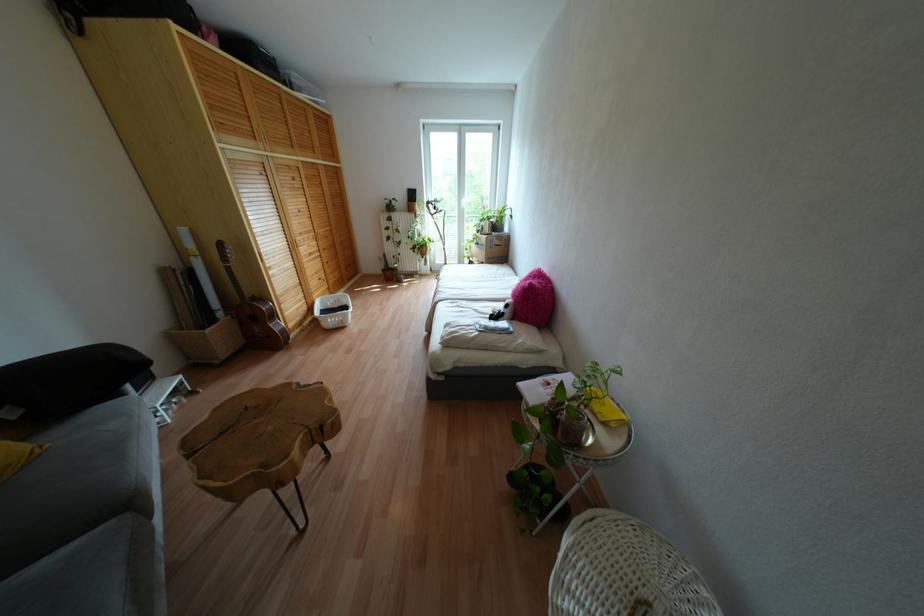
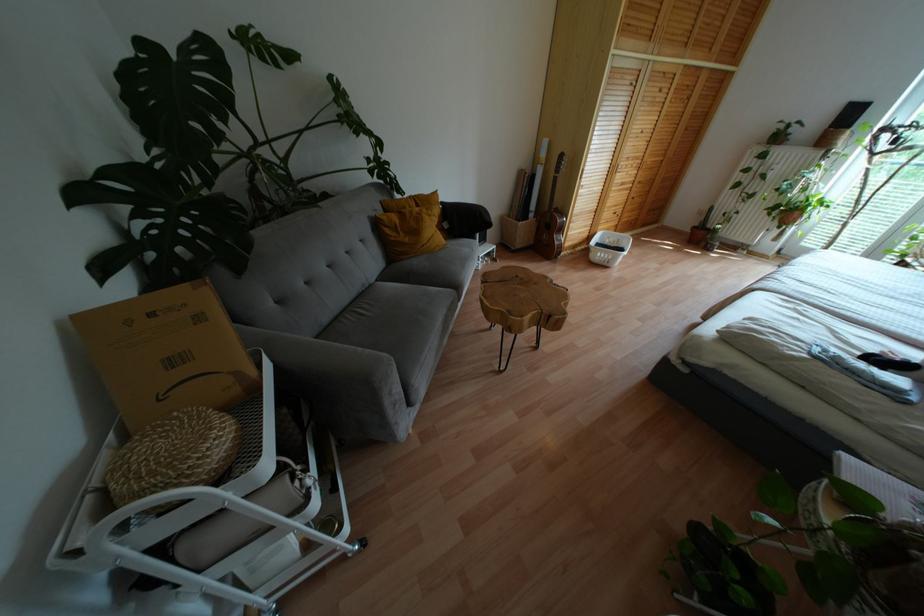
The point at (339, 325) is marked in the first image. Where is the corresponding point in the second image?

(604, 262)